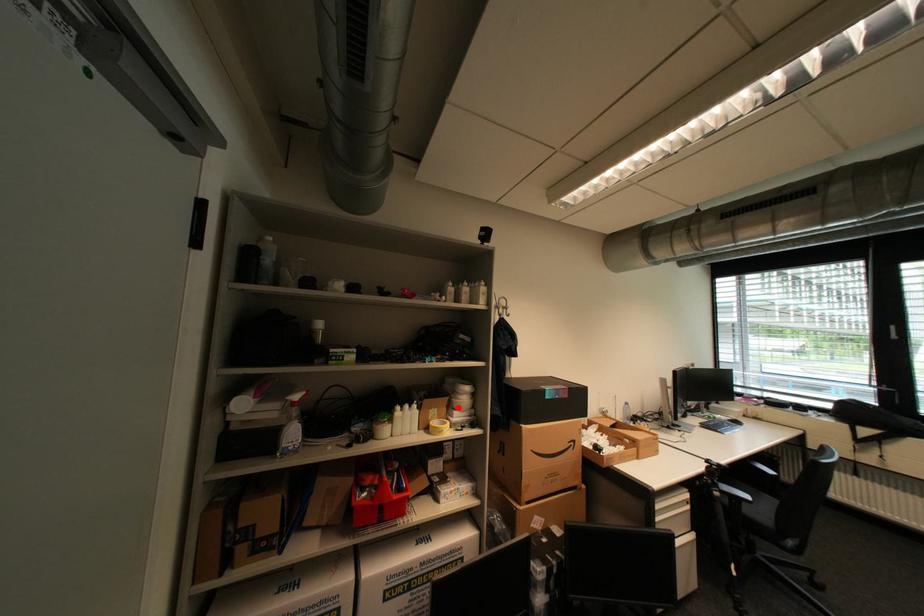
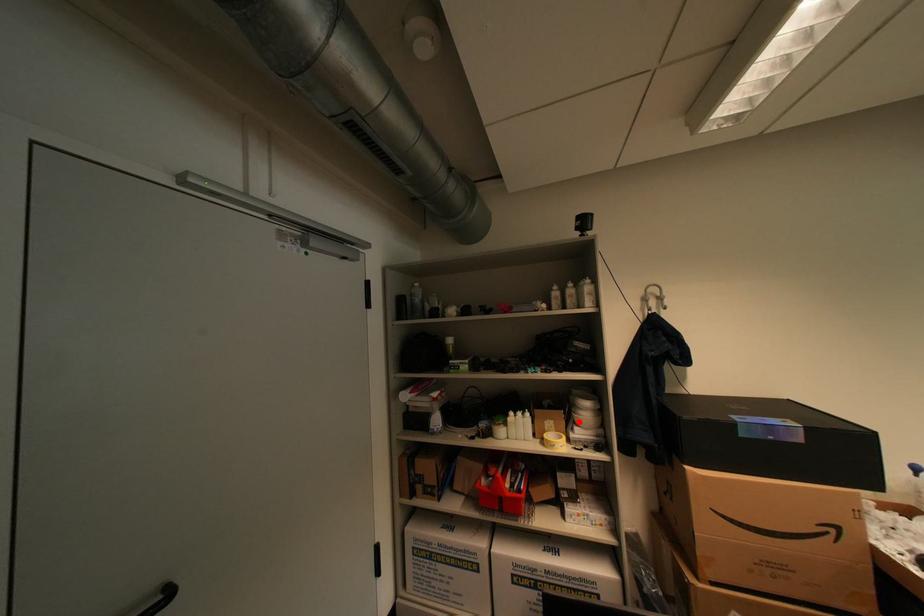
I am providing you with two images of the same scene from different viewpoints. A red point is marked on the first image and another point is marked on the second image. Is the red point in image1 aligned with the point shown in image2?

Yes